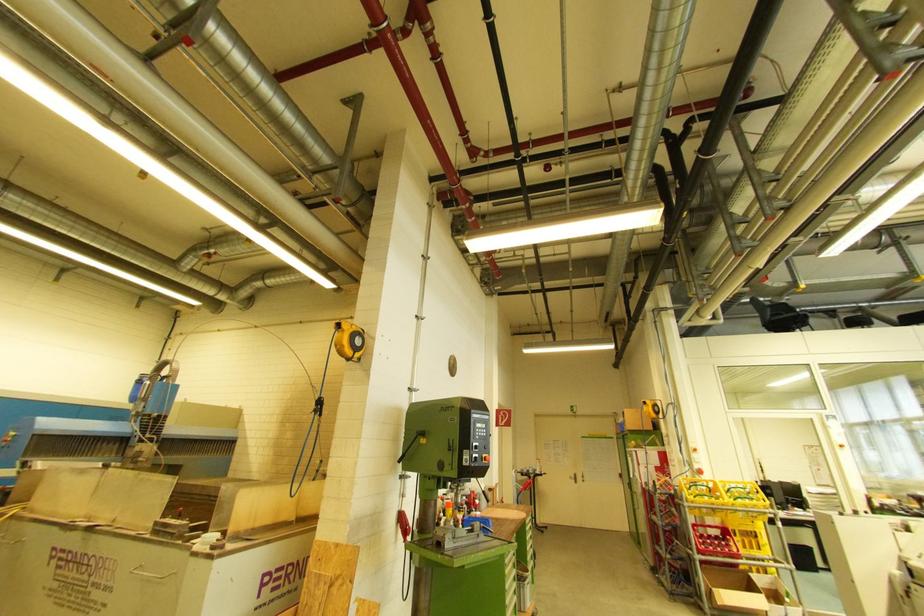
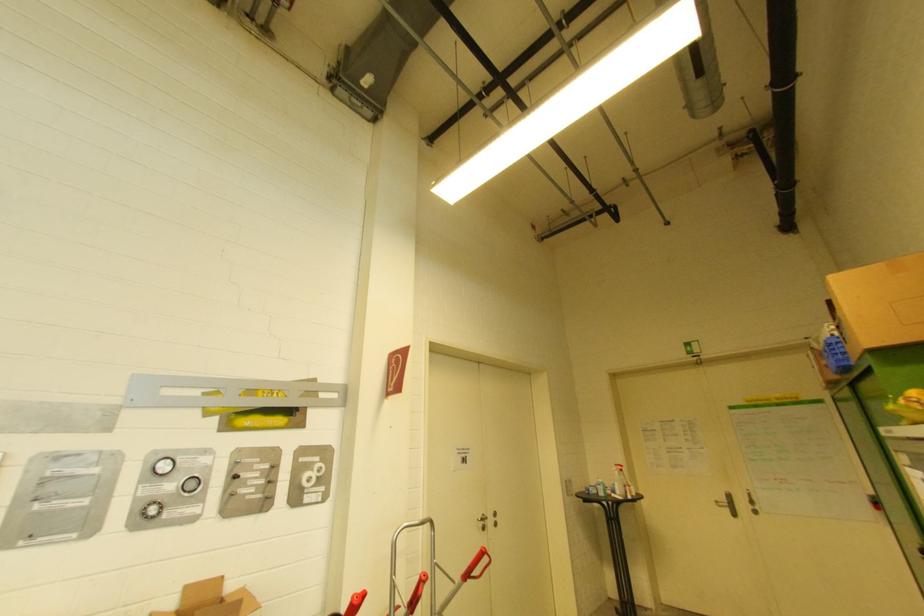
Where in the second image is the point corresponding to (x=578, y=477) from the first image?

(731, 498)